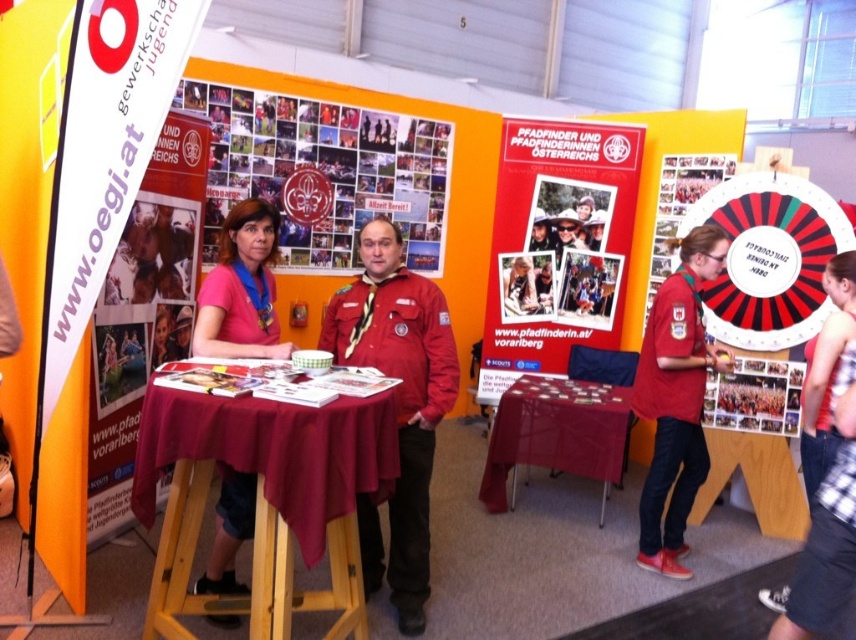
You are attending a fair and want to determine which clothing item takes up more horizontal space between the matte red jacket at center and the red cotton tank top at right. Which one is wider?

The matte red jacket at center is wider than the red cotton tank top at right.

You are standing at the entrance of the booth and want to approach the wooden table at center. Based on the coordinates given, in which direction should you move relative to your current position?

The wooden table at center is located at coordinates point (263, 499). Since you are at the entrance, you should move towards the center of the booth to reach the wooden table at center.